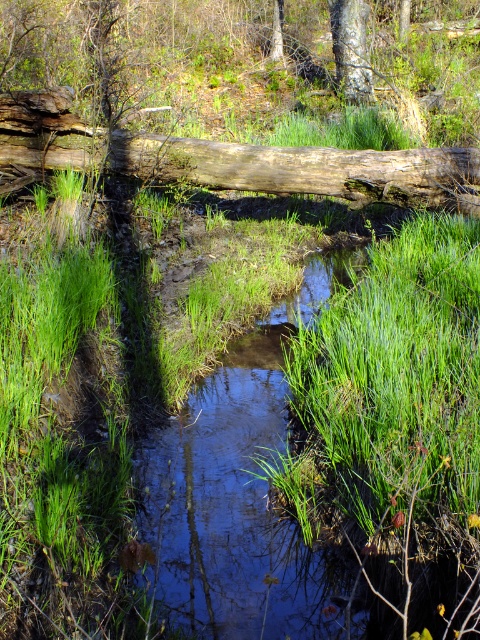
Question: Among these objects, which one is farthest from the camera?

Choices:
 (A) clear water stream at center
 (B) smooth gray tree trunk at upper center
 (C) weathered brown log at center

Answer: (B)

Question: Based on their relative distances, which object is nearer to the clear water stream at center?

Choices:
 (A) weathered brown log at center
 (B) smooth gray tree trunk at upper center

Answer: (A)

Question: Can you confirm if clear water stream at center is smaller than smooth gray tree trunk at upper center?

Choices:
 (A) yes
 (B) no

Answer: (B)

Question: Which point is farther from the camera taking this photo?

Choices:
 (A) (202, 166)
 (B) (305, 584)

Answer: (A)

Question: Where is clear water stream at center located in relation to smooth gray tree trunk at upper center in the image?

Choices:
 (A) left
 (B) right

Answer: (A)

Question: Does clear water stream at center have a greater width compared to weathered brown log at center?

Choices:
 (A) yes
 (B) no

Answer: (B)